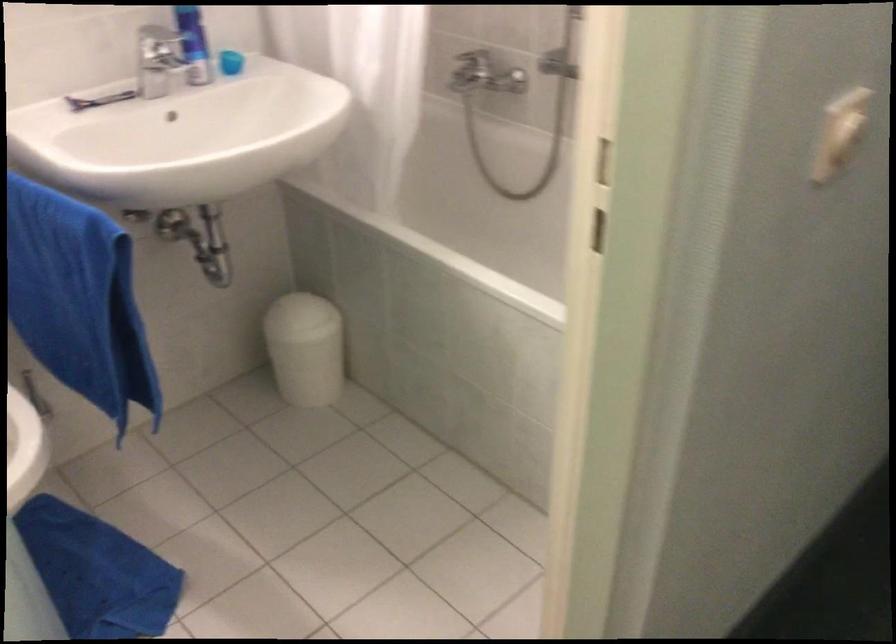
Find where to push the bottle pump top. Please return your answer as a coordinate pair (x, y).

(194, 44)